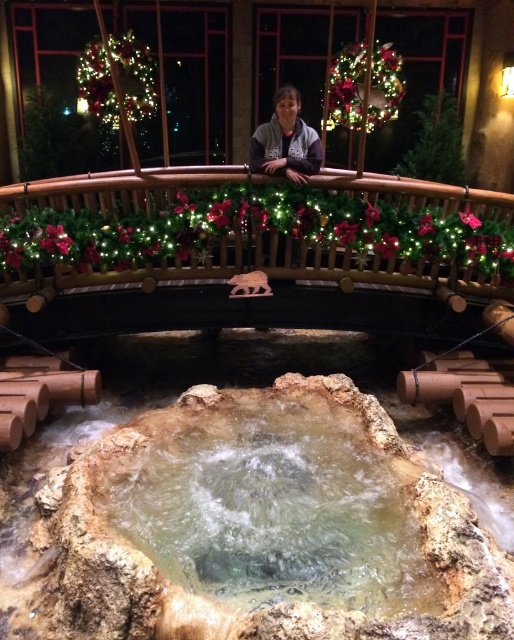
Question: Which of the following is the closest to the observer?

Choices:
 (A) (282, 156)
 (B) (155, 518)

Answer: (B)

Question: Does translucent rock water at center have a greater width compared to gray fleece jacket at upper center?

Choices:
 (A) yes
 (B) no

Answer: (A)

Question: Is translucent rock water at center closer to camera compared to gray fleece jacket at upper center?

Choices:
 (A) no
 (B) yes

Answer: (B)

Question: Which object appears farthest from the camera in this image?

Choices:
 (A) translucent rock water at center
 (B) gray fleece jacket at upper center

Answer: (B)

Question: From the image, what is the correct spatial relationship of translucent rock water at center in relation to gray fleece jacket at upper center?

Choices:
 (A) above
 (B) below

Answer: (B)

Question: Which object appears farthest from the camera in this image?

Choices:
 (A) translucent rock water at center
 (B) gray fleece jacket at upper center

Answer: (B)